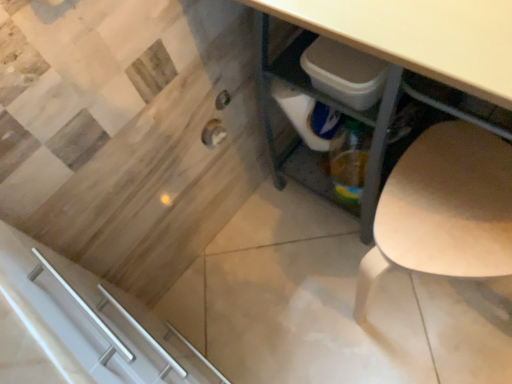
What are the coordinates of `blank space situated above light wood chair at lower right (from a real-world perspective)` in the screenshot? It's located at (444, 202).